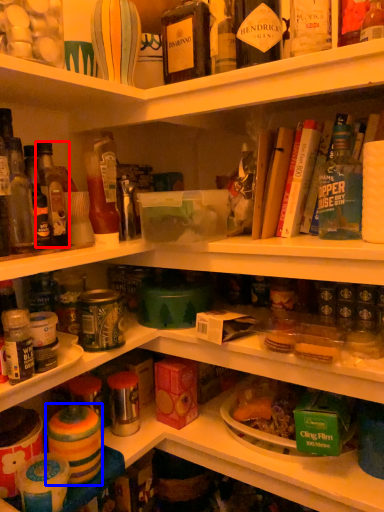
Question: Which object is closer to the camera taking this photo, bottle (highlighted by a red box) or food (highlighted by a blue box)?

Choices:
 (A) bottle
 (B) food

Answer: (B)